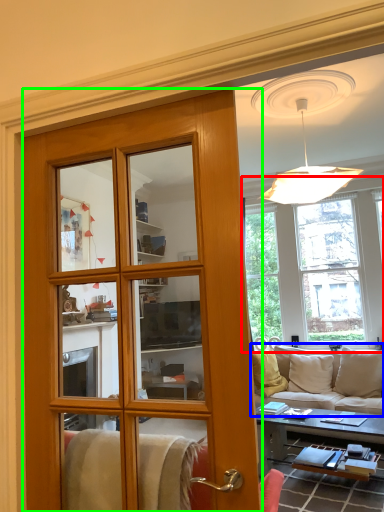
Question: Considering the real-world distances, which object is farthest from window (highlighted by a red box)? studio couch (highlighted by a blue box) or door (highlighted by a green box)?

Choices:
 (A) studio couch
 (B) door

Answer: (B)